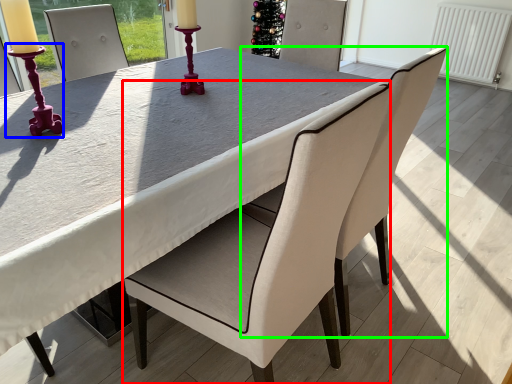
Question: Based on their relative distances, which object is nearer to chair (highlighted by a red box)? Choose from candle holder (highlighted by a blue box) and chair (highlighted by a green box).

Choices:
 (A) candle holder
 (B) chair

Answer: (B)